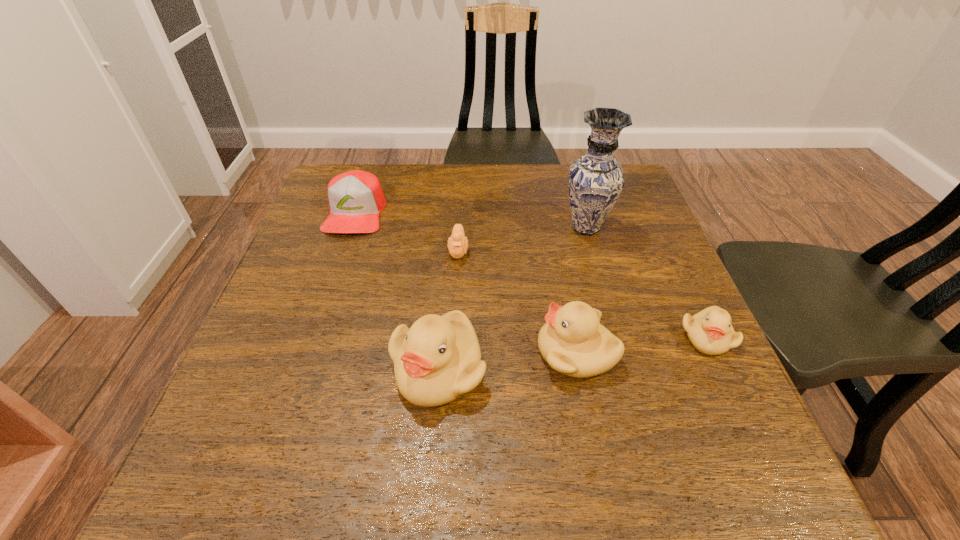
Locate an element on the screen. The width and height of the screenshot is (960, 540). free point at the near edge is located at coordinates (536, 400).

This screenshot has width=960, height=540. I want to click on free region at the left edge of the desktop, so click(x=268, y=348).

The image size is (960, 540). In order to click on vacant region at the right edge of the desktop in this screenshot , I will do `click(658, 226)`.

In order to click on vacant space at the far left corner in this screenshot , I will do `click(379, 174)`.

Identify the location of free point at the near left corner. (242, 396).

In the image, there is a desktop. Where is `vacant region at the far right corner`? The width and height of the screenshot is (960, 540). vacant region at the far right corner is located at coordinates (624, 184).

The height and width of the screenshot is (540, 960). What are the coordinates of `vacant space that's between the farthest duckling and the vase` in the screenshot? It's located at (522, 239).

Locate an element on the screen. The width and height of the screenshot is (960, 540). empty space between the vase and the shortest duckling is located at coordinates (522, 239).

Identify the location of free space between the vase and the baseball cap. pyautogui.click(x=470, y=220).

This screenshot has width=960, height=540. I want to click on vacant space that's between the second duckling from right to left and the farthest duckling, so (517, 301).